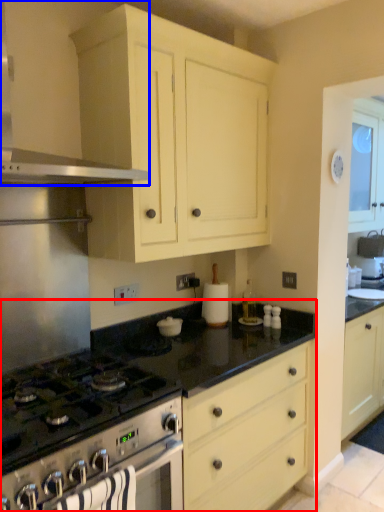
Question: Among these objects, which one is farthest to the camera, countertop (highlighted by a red box) or kitchen appliance (highlighted by a blue box)?

Choices:
 (A) countertop
 (B) kitchen appliance

Answer: (A)